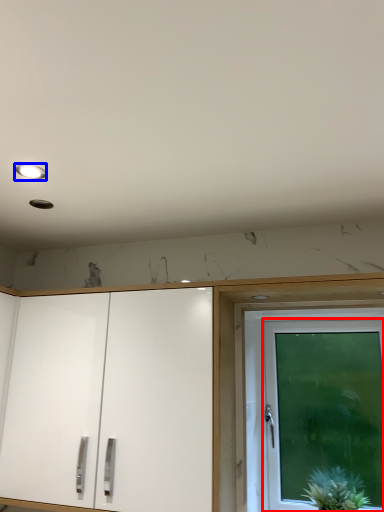
Question: Which of the following is the farthest to the observer, door (highlighted by a red box) or lighting (highlighted by a blue box)?

Choices:
 (A) door
 (B) lighting

Answer: (A)